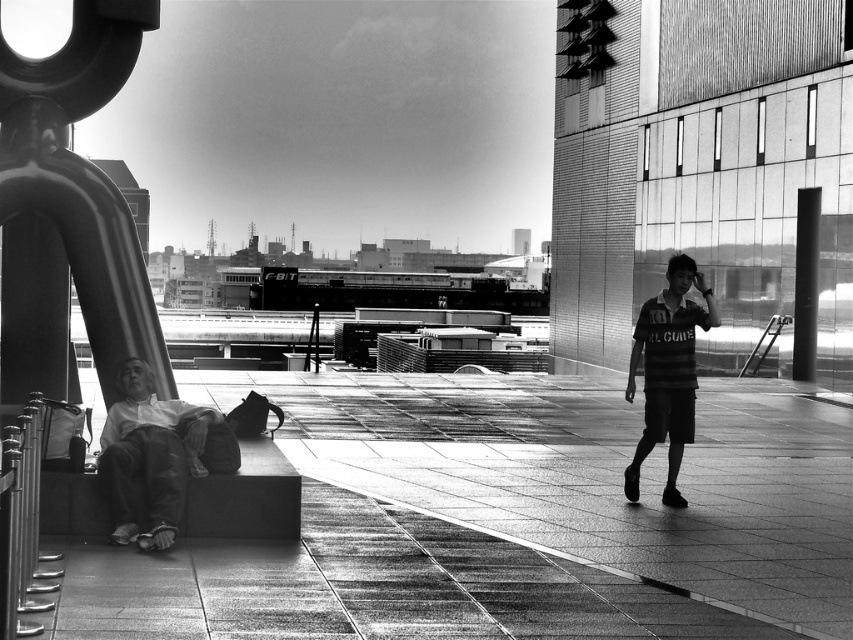
Does smooth concrete pavement at center have a lesser width compared to striped jersey at center?

Incorrect, smooth concrete pavement at center's width is not less than striped jersey at center's.

Who is higher up, smooth concrete pavement at center or striped jersey at center?

striped jersey at center

The height and width of the screenshot is (640, 853). What do you see at coordinates (509, 518) in the screenshot?
I see `smooth concrete pavement at center` at bounding box center [509, 518].

At what (x,y) coordinates should I click in order to perform the action: click on smooth concrete pavement at center. Please return your answer as a coordinate pair (x, y). The width and height of the screenshot is (853, 640). Looking at the image, I should click on (509, 518).

Looking at this image, is light gray cotton pants at lower left wider than striped jersey at center?

Yes.

Can you confirm if light gray cotton pants at lower left is positioned to the right of striped jersey at center?

Incorrect, light gray cotton pants at lower left is not on the right side of striped jersey at center.

Is point (119, 513) closer to viewer compared to point (672, 266)?

Yes, it is.

The width and height of the screenshot is (853, 640). In order to click on light gray cotton pants at lower left in this screenshot , I will do `click(155, 458)`.

Describe the element at coordinates (509, 518) in the screenshot. I see `smooth concrete pavement at center` at that location.

Is point (347, 444) positioned after point (200, 419)?

That is True.

Is point (614, 625) behind point (170, 513)?

No, (614, 625) is in front of (170, 513).

You are a GUI agent. You are given a task and a screenshot of the screen. Output one action in this format:
    pyautogui.click(x=<x>, y=<y>)
    Task: Click on the smooth concrete pavement at center
    
    Given the screenshot: What is the action you would take?
    pyautogui.click(x=509, y=518)